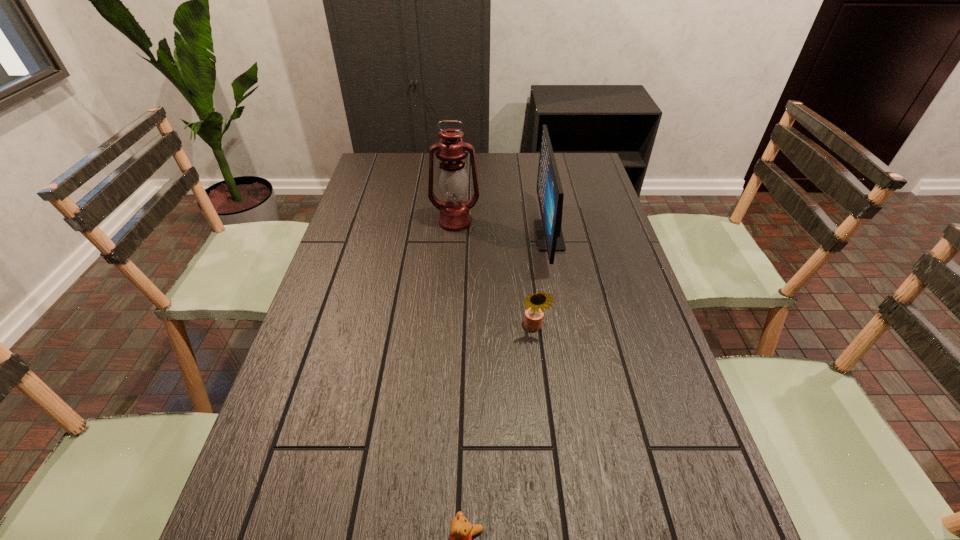
Identify the location of vacant space at the far edge. The height and width of the screenshot is (540, 960). (439, 168).

Locate an element on the screen. free space at the left edge is located at coordinates [349, 245].

This screenshot has height=540, width=960. What are the coordinates of `vacant space at the right edge` in the screenshot? It's located at (599, 196).

Locate an element on the screen. free space between the sunflower and the third shortest object is located at coordinates (541, 281).

Identify the location of free space between the rightmost object and the third farthest object. (541, 281).

You are a GUI agent. You are given a task and a screenshot of the screen. Output one action in this format:
    pyautogui.click(x=<x>, y=<y>)
    Task: Click on the unoccupied area between the computer monitor and the oil lamp
    This screenshot has height=540, width=960.
    Given the screenshot: What is the action you would take?
    pyautogui.click(x=502, y=228)

Find the location of a particular element. This screenshot has height=540, width=960. free space between the second tallest object and the oil lamp is located at coordinates (502, 228).

At what (x,y) coordinates should I click in order to perform the action: click on free spot between the computer monitor and the third object from left to right. Please return your answer as a coordinate pair (x, y). Image resolution: width=960 pixels, height=540 pixels. Looking at the image, I should click on (541, 281).

You are a GUI agent. You are given a task and a screenshot of the screen. Output one action in this format:
    pyautogui.click(x=<x>, y=<y>)
    Task: Click on the object that stands as the second closest to the rightmost object
    
    Given the screenshot: What is the action you would take?
    pyautogui.click(x=452, y=179)

Identify which object is the second closest to the oil lamp. Please provide its 2D coordinates. Your answer should be formatted as a tuple, i.e. [(x, y)], where the tuple contains the x and y coordinates of a point satisfying the conditions above.

[(535, 303)]